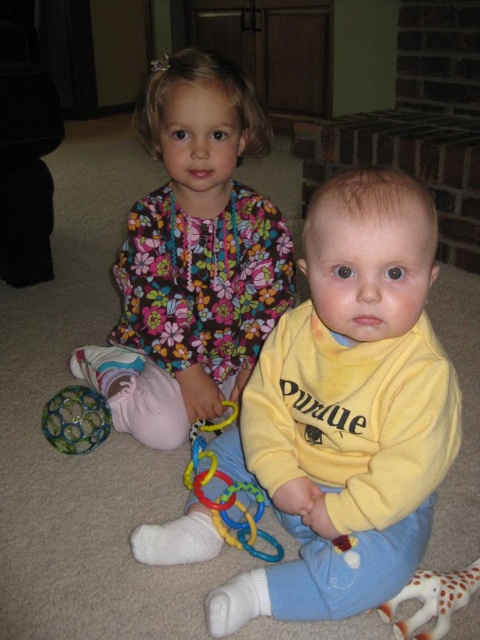
Question: Is yellow fleece sweater at center thinner than white rubber giraffe at lower right?

Choices:
 (A) no
 (B) yes

Answer: (A)

Question: From the image, what is the correct spatial relationship of rubber rings at center in relation to white rubber giraffe at lower right?

Choices:
 (A) above
 (B) below

Answer: (A)

Question: Among these points, which one is farthest from the camera?

Choices:
 (A) (122, 332)
 (B) (72, 420)
 (C) (337, 516)
 (D) (441, 593)

Answer: (A)

Question: Considering the relative positions of floral fabric dress at upper left and rubber rings at center in the image provided, where is floral fabric dress at upper left located with respect to rubber rings at center?

Choices:
 (A) left
 (B) right

Answer: (A)

Question: Which point is closer to the camera taking this photo?

Choices:
 (A) (228, 380)
 (B) (335, 472)
 (C) (241, 545)

Answer: (B)

Question: Among these points, which one is nearest to the camera?

Choices:
 (A) (391, 573)
 (B) (192, 451)
 (C) (76, 396)
 (D) (425, 620)

Answer: (D)